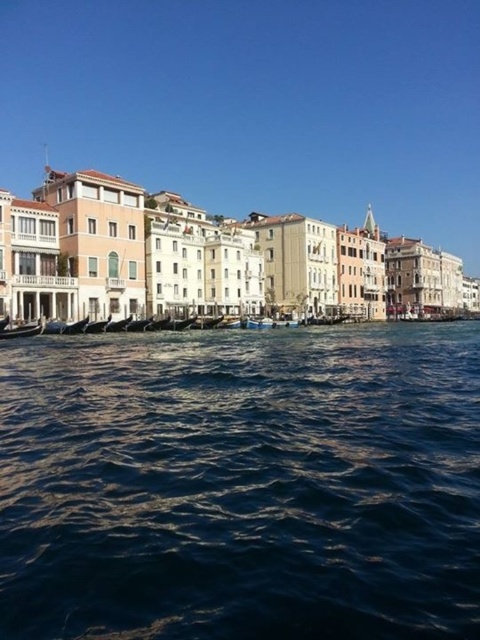
Does dark blue water at center appear on the right side of wooden gondola at lower left?

Yes, dark blue water at center is to the right of wooden gondola at lower left.

Measure the distance from dark blue water at center to wooden gondola at lower left.

25.42 meters

What do you see at coordinates (241, 484) in the screenshot?
I see `dark blue water at center` at bounding box center [241, 484].

Find the location of a particular element. The width and height of the screenshot is (480, 640). dark blue water at center is located at coordinates (241, 484).